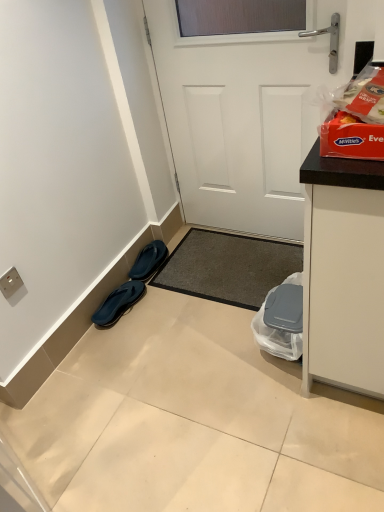
What do you see at coordinates (148, 260) in the screenshot?
I see `black rubber flip-flops at lower left, which ranks as the second footwear in bottom-to-top order` at bounding box center [148, 260].

Measure the distance between dark gray carpet at center and camera.

6.09 feet.

What do you see at coordinates (238, 120) in the screenshot?
I see `white matte door at center` at bounding box center [238, 120].

Identify the location of black rubber flip-flops at lower left, which appears as the 1th footwear when ordered from the bottom. The height and width of the screenshot is (512, 384). (118, 303).

From a real-world perspective, which is physically below, black rubber flip-flops at lower left, which ranks as the second footwear in bottom-to-top order, or dark gray carpet at center?

dark gray carpet at center, from a real-world perspective.

Can you confirm if black rubber flip-flops at lower left, which ranks as the second footwear in bottom-to-top order, is smaller than dark gray carpet at center?

Yes, black rubber flip-flops at lower left, which ranks as the second footwear in bottom-to-top order, is smaller than dark gray carpet at center.

Which is in front, point (152, 246) or point (256, 259)?

The point (256, 259) is more forward.

How many degrees apart are the facing directions of black rubber flip-flops at lower left, which ranks as the second footwear in bottom-to-top order, and dark gray carpet at center?

The angle between the facing direction of black rubber flip-flops at lower left, which ranks as the second footwear in bottom-to-top order, and the facing direction of dark gray carpet at center is 89.9 degrees.

Which of these two, white plastic electric outlet at lower left or dark gray carpet at center, is wider?

dark gray carpet at center.

From the image's perspective, which is above, white plastic electric outlet at lower left or dark gray carpet at center?

dark gray carpet at center appears higher in the image.

Considering the positions of objects white plastic electric outlet at lower left and dark gray carpet at center in the image provided, who is more to the right, white plastic electric outlet at lower left or dark gray carpet at center?

From the viewer's perspective, dark gray carpet at center appears more on the right side.

Is white plastic electric outlet at lower left positioned in front of dark gray carpet at center?

Yes, white plastic electric outlet at lower left is closer to the viewer.

Is the surface of red cardboard box of mcvitie's everlasting wafers at upper right in direct contact with black rubber flip-flops at lower left, which is counted as the 1th footwear, starting from the top?

No.

Can we say red cardboard box of mcvitie's everlasting wafers at upper right lies outside black rubber flip-flops at lower left, which ranks as the second footwear in bottom-to-top order?

Indeed, red cardboard box of mcvitie's everlasting wafers at upper right is completely outside black rubber flip-flops at lower left, which ranks as the second footwear in bottom-to-top order.

Which object is further away from the camera taking this photo, red cardboard box of mcvitie's everlasting wafers at upper right or black rubber flip-flops at lower left, which is counted as the 1th footwear, starting from the top?

black rubber flip-flops at lower left, which is counted as the 1th footwear, starting from the top, is further away from the camera.

Which of these two, red cardboard box of mcvitie's everlasting wafers at upper right or black rubber flip-flops at lower left, which is counted as the 1th footwear, starting from the top, is smaller?

black rubber flip-flops at lower left, which is counted as the 1th footwear, starting from the top, is smaller.

Who is bigger, white matte door at center or black rubber flip-flops at lower left, which is counted as the 1th footwear, starting from the top?

white matte door at center.

Considering the relative positions of white matte door at center and black rubber flip-flops at lower left, which ranks as the second footwear in bottom-to-top order, in the image provided, is white matte door at center to the left or to the right of black rubber flip-flops at lower left, which ranks as the second footwear in bottom-to-top order,?

Based on their positions, white matte door at center is located to the right of black rubber flip-flops at lower left, which ranks as the second footwear in bottom-to-top order.

Would you say white matte door at center is outside black rubber flip-flops at lower left, which is counted as the 1th footwear, starting from the top?

Yes, white matte door at center is not within black rubber flip-flops at lower left, which is counted as the 1th footwear, starting from the top.

Is white matte door at center beside black rubber flip-flops at lower left, which is counted as the 1th footwear, starting from the top?

No.

In the scene shown: Is dark gray carpet at center far from white plastic electric outlet at lower left?

That's not correct — dark gray carpet at center is a little close to white plastic electric outlet at lower left.

Is the position of dark gray carpet at center more distant than that of white plastic electric outlet at lower left?

Yes, dark gray carpet at center is further from the camera.

How much distance is there between dark gray carpet at center and white plastic electric outlet at lower left?

dark gray carpet at center and white plastic electric outlet at lower left are 38.46 inches apart from each other.

Can we say dark gray carpet at center lies outside white plastic electric outlet at lower left?

dark gray carpet at center is positioned outside white plastic electric outlet at lower left.

Considering the sizes of red cardboard box of mcvitie's everlasting wafers at upper right and white matte door at center in the image, is red cardboard box of mcvitie's everlasting wafers at upper right taller or shorter than white matte door at center?

red cardboard box of mcvitie's everlasting wafers at upper right is shorter than white matte door at center.

Is red cardboard box of mcvitie's everlasting wafers at upper right with white matte door at center?

No.

Is red cardboard box of mcvitie's everlasting wafers at upper right turned away from white matte door at center?

No, red cardboard box of mcvitie's everlasting wafers at upper right is not facing the opposite direction of white matte door at center.

How much distance is there between red cardboard box of mcvitie's everlasting wafers at upper right and white matte door at center?

They are 33.81 inches apart.

Find the location of a particular element. doormat that appears below the white matte door at center (from a real-world perspective) is located at coordinates (228, 267).

Is point (267, 234) less distant than point (190, 272)?

No.

Is white matte door at center oriented away from dark gray carpet at center?

No, white matte door at center's orientation is not away from dark gray carpet at center.

How distant is white matte door at center from dark gray carpet at center?

white matte door at center is 17.38 inches away from dark gray carpet at center.

Where is `the 2nd footwear directly above the dark gray carpet at center (from a real-world perspective)`? the 2nd footwear directly above the dark gray carpet at center (from a real-world perspective) is located at coordinates (148, 260).

Where is `doormat directly beneath the white plastic electric outlet at lower left (from a real-world perspective)`? The width and height of the screenshot is (384, 512). doormat directly beneath the white plastic electric outlet at lower left (from a real-world perspective) is located at coordinates (228, 267).

Considering their positions, is red cardboard box of mcvitie's everlasting wafers at upper right positioned further to dark gray carpet at center than white matte door at center?

Based on the image, red cardboard box of mcvitie's everlasting wafers at upper right appears to be further to dark gray carpet at center.

Estimate the real-world distances between objects in this image. Which object is closer to white plastic electric outlet at lower left, dark gray carpet at center or white matte door at center?

dark gray carpet at center is positioned closer to the anchor white plastic electric outlet at lower left.

Which object lies nearer to the anchor point black rubber flip-flops at lower left, which is counted as the 1th footwear, starting from the top, white plastic electric outlet at lower left or red cardboard box of mcvitie's everlasting wafers at upper right?

Based on the image, white plastic electric outlet at lower left appears to be nearer to black rubber flip-flops at lower left, which is counted as the 1th footwear, starting from the top.

Considering their positions, is white plastic electric outlet at lower left positioned further to dark gray carpet at center than black rubber flip-flops at lower left, which ranks as the second footwear in bottom-to-top order?

white plastic electric outlet at lower left.

From the image, which object appears to be nearer to white matte door at center, black rubber flip-flops at lower left, the second footwear when ordered from top to bottom, or red cardboard box of mcvitie's everlasting wafers at upper right?

black rubber flip-flops at lower left, the second footwear when ordered from top to bottom, is positioned closer to the anchor white matte door at center.

From the image, which object appears to be farther from black rubber flip-flops at lower left, which ranks as the second footwear in bottom-to-top order, white matte door at center or dark gray carpet at center?

The object further to black rubber flip-flops at lower left, which ranks as the second footwear in bottom-to-top order, is white matte door at center.

Looking at the image, which one is located closer to black rubber flip-flops at lower left, which appears as the 1th footwear when ordered from the bottom, dark gray carpet at center or white plastic electric outlet at lower left?

dark gray carpet at center is closer to black rubber flip-flops at lower left, which appears as the 1th footwear when ordered from the bottom.

Based on their spatial positions, is black rubber flip-flops at lower left, the second footwear when ordered from top to bottom, or white matte door at center further from black rubber flip-flops at lower left, which is counted as the 1th footwear, starting from the top?

The object further to black rubber flip-flops at lower left, which is counted as the 1th footwear, starting from the top, is white matte door at center.

At what (x,y) coordinates should I click in order to perform the action: click on footwear located between black rubber flip-flops at lower left, which appears as the 1th footwear when ordered from the bottom, and dark gray carpet at center in the left-right direction. Please return your answer as a coordinate pair (x, y). The image size is (384, 512). Looking at the image, I should click on (148, 260).

Find the location of a particular element. Image resolution: width=384 pixels, height=512 pixels. door between red cardboard box of mcvitie's everlasting wafers at upper right and dark gray carpet at center in the front-back direction is located at coordinates (238, 120).

The height and width of the screenshot is (512, 384). Find the location of `doormat between white plastic electric outlet at lower left and white matte door at center`. doormat between white plastic electric outlet at lower left and white matte door at center is located at coordinates (228, 267).

In order to click on doormat between white matte door at center and black rubber flip-flops at lower left, which appears as the 1th footwear when ordered from the bottom, in the up-down direction in this screenshot , I will do `click(228, 267)`.